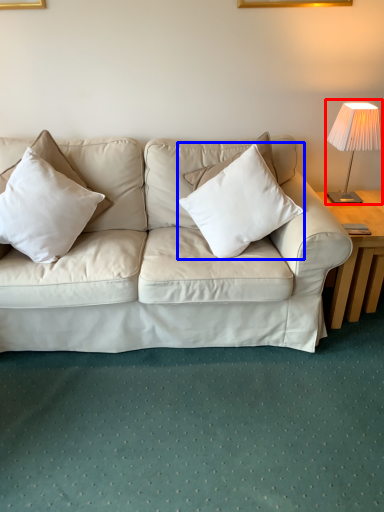
Question: Which object is further to the camera taking this photo, table lamp (highlighted by a red box) or pillow (highlighted by a blue box)?

Choices:
 (A) table lamp
 (B) pillow

Answer: (A)